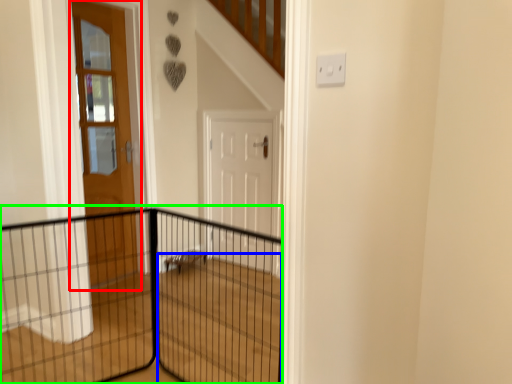
Question: Based on their relative distances, which object is nearer to door (highlighted by a red box)? Choose from stairwell (highlighted by a blue box) and fence (highlighted by a green box).

Choices:
 (A) stairwell
 (B) fence

Answer: (B)